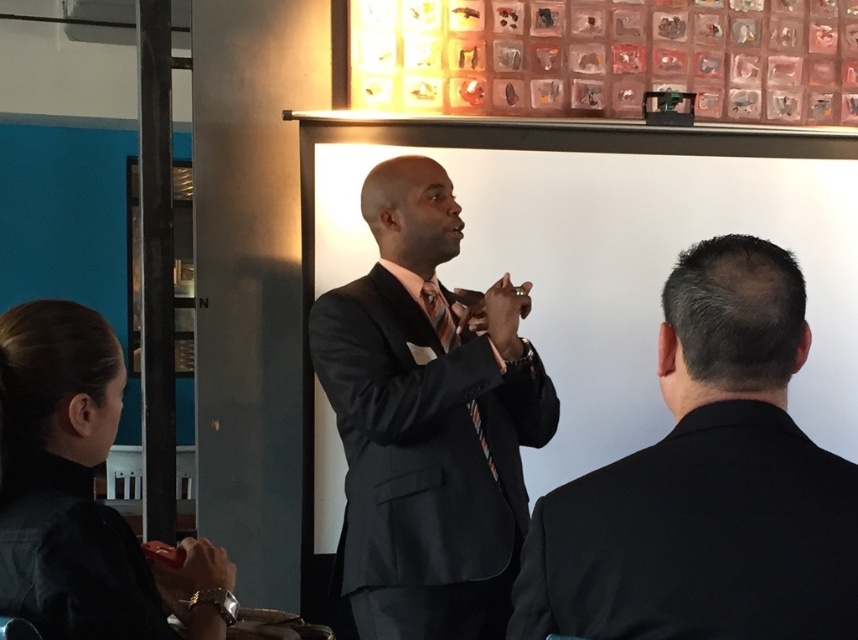
Is black suit at center bigger than matte black suit at center?

Incorrect, black suit at center is not larger than matte black suit at center.

Is black suit at center positioned in front of matte black suit at center?

Yes, black suit at center is in front of matte black suit at center.

Who is more distant from viewer, (665, 518) or (384, 166)?

Point (384, 166)

Find the location of a particular element. The height and width of the screenshot is (640, 858). black suit at center is located at coordinates click(705, 484).

Between black suit at center and striped silk tie at center, which one appears on the right side from the viewer's perspective?

From the viewer's perspective, black suit at center appears more on the right side.

Can you confirm if black suit at center is wider than striped silk tie at center?

Correct, the width of black suit at center exceeds that of striped silk tie at center.

What do you see at coordinates (705, 484) in the screenshot? I see `black suit at center` at bounding box center [705, 484].

At what (x,y) coordinates should I click in order to perform the action: click on black suit at center. Please return your answer as a coordinate pair (x, y). Looking at the image, I should click on (705, 484).

Can you confirm if matte black suit at center is positioned to the right of striped silk tie at center?

No, matte black suit at center is not to the right of striped silk tie at center.

Which of these two, matte black suit at center or striped silk tie at center, stands shorter?

Standing shorter between the two is striped silk tie at center.

Locate an element on the screen. Image resolution: width=858 pixels, height=640 pixels. matte black suit at center is located at coordinates (427, 422).